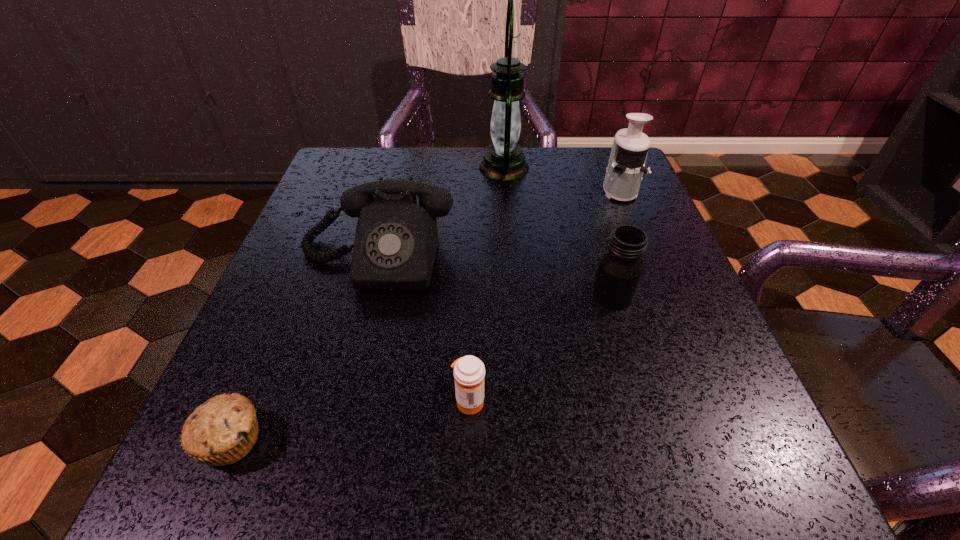
Find the location of a particular element. lantern is located at coordinates (504, 160).

You are a GUI agent. You are given a task and a screenshot of the screen. Output one action in this format:
    pyautogui.click(x=<x>, y=<y>)
    Task: Click on the juicer
    Image resolution: width=960 pixels, height=540 pixels.
    Given the screenshot: What is the action you would take?
    pyautogui.click(x=626, y=165)

In order to click on the second tallest object in this screenshot , I will do coord(626,165).

At what (x,y) coordinates should I click in order to perform the action: click on telephone. Please return your answer as a coordinate pair (x, y). Looking at the image, I should click on (396, 240).

Identify the location of jar. (620, 269).

You are a GUI agent. You are given a task and a screenshot of the screen. Output one action in this format:
    pyautogui.click(x=<x>, y=<y>)
    Task: Click on the medicine
    
    Given the screenshot: What is the action you would take?
    pyautogui.click(x=469, y=372)

You are a GUI agent. You are given a task and a screenshot of the screen. Output one action in this format:
    pyautogui.click(x=<x>, y=<y>)
    Task: Click on the shortest object
    Image resolution: width=960 pixels, height=540 pixels.
    Given the screenshot: What is the action you would take?
    pyautogui.click(x=221, y=431)

At what (x,y) coordinates should I click in order to perform the action: click on free space located 0.090m on the side where the tallest object emits light. Please return your answer as a coordinate pair (x, y). Looking at the image, I should click on (441, 167).

The width and height of the screenshot is (960, 540). In order to click on vacant space located on the side where the tallest object emits light in this screenshot , I will do `click(348, 167)`.

This screenshot has width=960, height=540. I want to click on vacant area located 0.230m on the side where the tallest object emits light, so click(x=381, y=167).